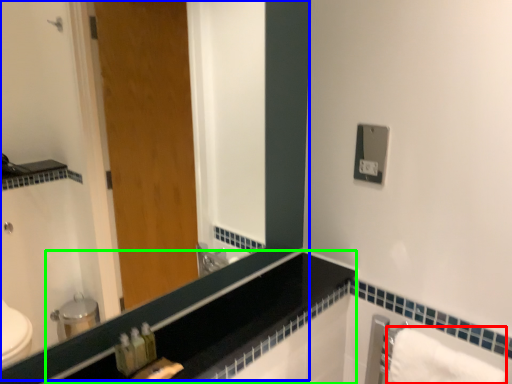
Question: Which is farther away from bath towel (highlighted by a red box)? mirror (highlighted by a blue box) or counter top (highlighted by a green box)?

Choices:
 (A) mirror
 (B) counter top

Answer: (A)